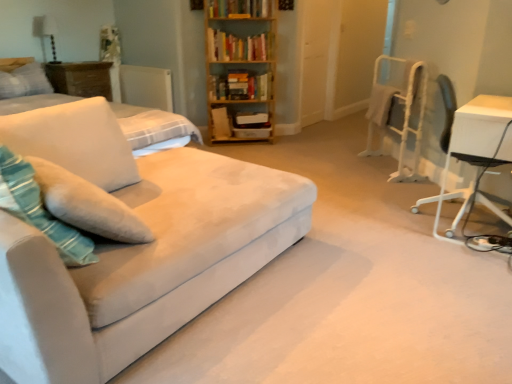
Identify the location of vacant space in between wooden bookcase at upper center and white plastic chair at right. The image size is (512, 384). (309, 158).